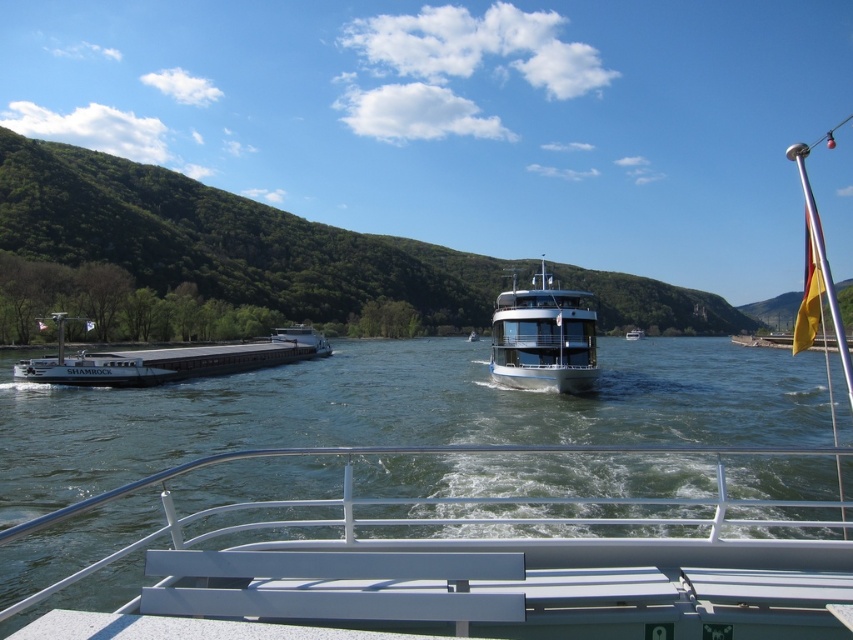
You are a crane operator tasked with lifting cargo from the matte gray barge at left onto the metallic silver boat at center. Considering their heights, will the cargo be able to be lifted directly without needing to adjust the crane height?

The metallic silver boat at center has a greater height compared to the matte gray barge at left, so the crane operator will need to adjust the crane height to accommodate the difference in elevation between the two vessels.

You are standing on the deck of the passenger ship in the middle ground. Looking towards the left, you see a point marked at coordinates (x=172, y=360). What object does this point correspond to?

The point at (x=172, y=360) corresponds to the matte gray barge at left.

You are standing on the deck of the boat and want to take a photo of both the matte gray barge at left and the white glossy boat at center. Since you have a camera with a fixed focal length, you need to ensure both are fully visible in the frame. Given their heights, which boat should you position closer to the camera to avoid cropping either?

The matte gray barge at left is taller than the white glossy boat at center. To ensure both are fully visible without cropping, position the taller matte gray barge at left closer to the camera. This adjustment allows the taller barge to occupy more of the vertical frame while keeping the shorter boat within view.